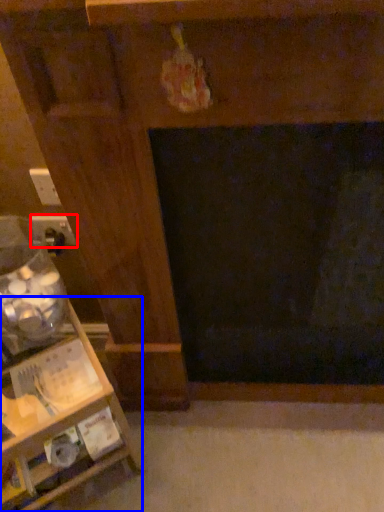
Question: Which object is further to the camera taking this photo, electric outlet (highlighted by a red box) or furniture (highlighted by a blue box)?

Choices:
 (A) electric outlet
 (B) furniture

Answer: (A)